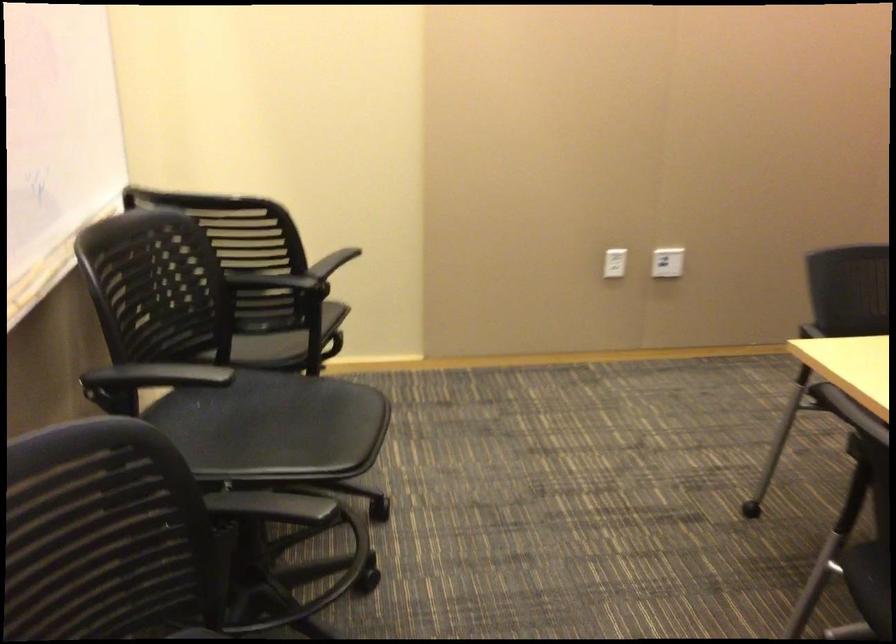
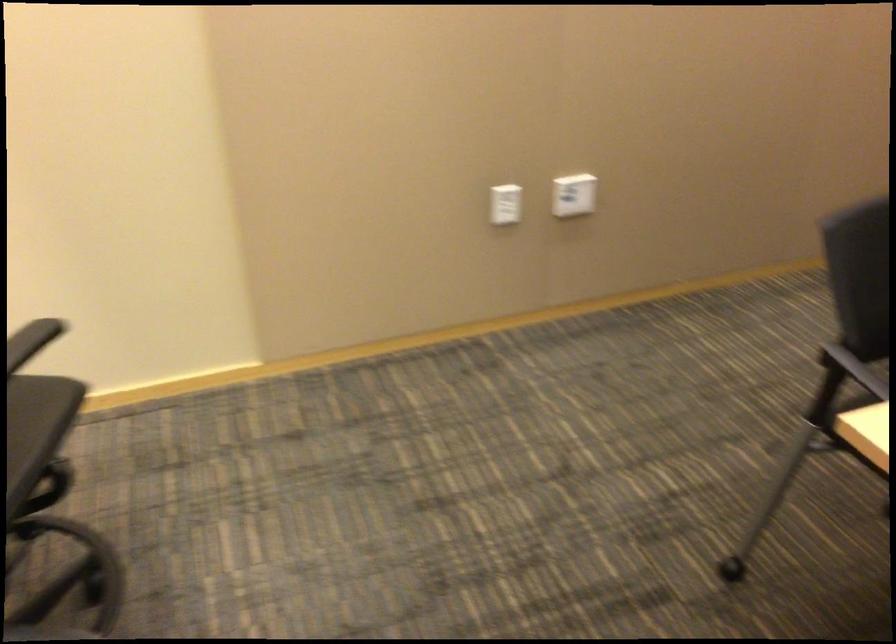
Question: The first image is from the beginning of the video and the second image is from the end. How did the camera likely rotate when shooting the video?

Choices:
 (A) Left
 (B) Right
 (C) Up
 (D) Down

Answer: (D)